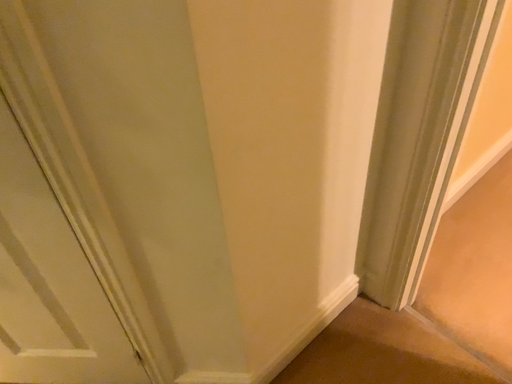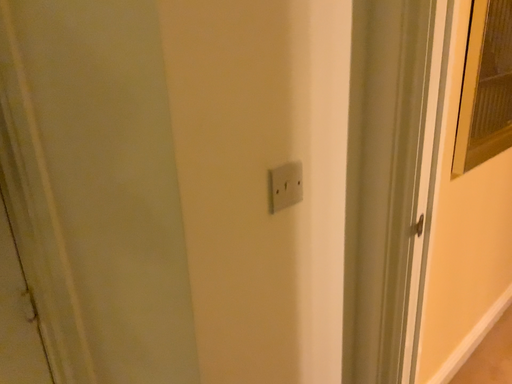
Question: Which way did the camera rotate in the video?

Choices:
 (A) rotated upward
 (B) rotated downward

Answer: (A)